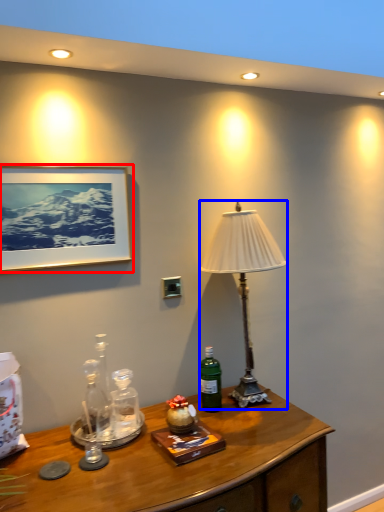
Question: Which object is further to the camera taking this photo, picture frame (highlighted by a red box) or lamp (highlighted by a blue box)?

Choices:
 (A) picture frame
 (B) lamp

Answer: (B)